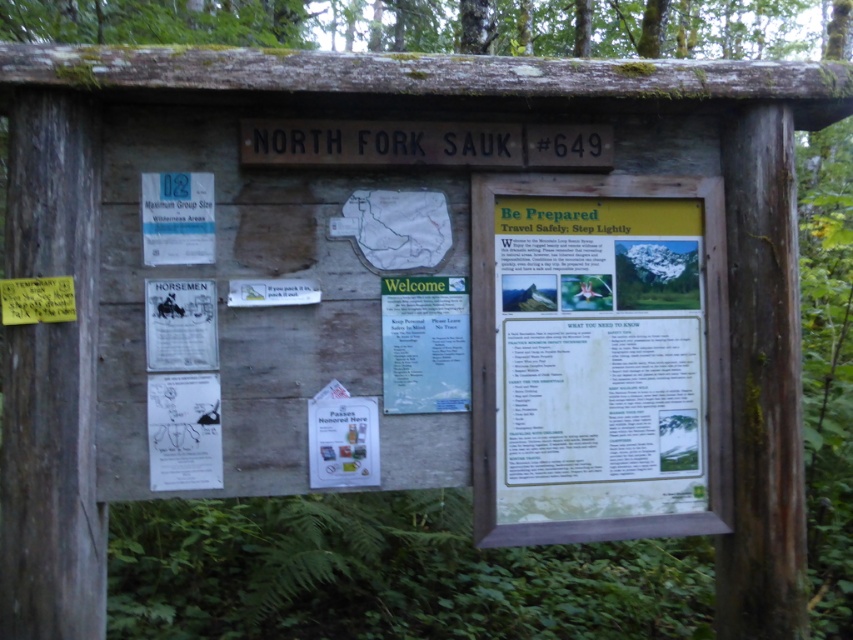
Does matte yellow poster at center right have a smaller size compared to white paper poster at left?

No, matte yellow poster at center right is not smaller than white paper poster at left.

Is point (509, 362) farther from camera compared to point (192, 332)?

Yes, point (509, 362) is farther from viewer.

Where is `matte yellow poster at center right`? Image resolution: width=853 pixels, height=640 pixels. matte yellow poster at center right is located at coordinates (598, 356).

This screenshot has width=853, height=640. In order to click on matte yellow poster at center right in this screenshot , I will do `click(598, 356)`.

Is green paper poster at center above white paper poster at left?

Actually, green paper poster at center is below white paper poster at left.

In order to click on green paper poster at center in this screenshot , I will do `click(424, 342)`.

Find the location of `green paper poster at center`. green paper poster at center is located at coordinates (424, 342).

The image size is (853, 640). Describe the element at coordinates (180, 324) in the screenshot. I see `white paper poster at left` at that location.

Who is taller, white paper poster at left or white paper poster at center?

Standing taller between the two is white paper poster at center.

Locate an element on the screen. white paper poster at left is located at coordinates (180, 324).